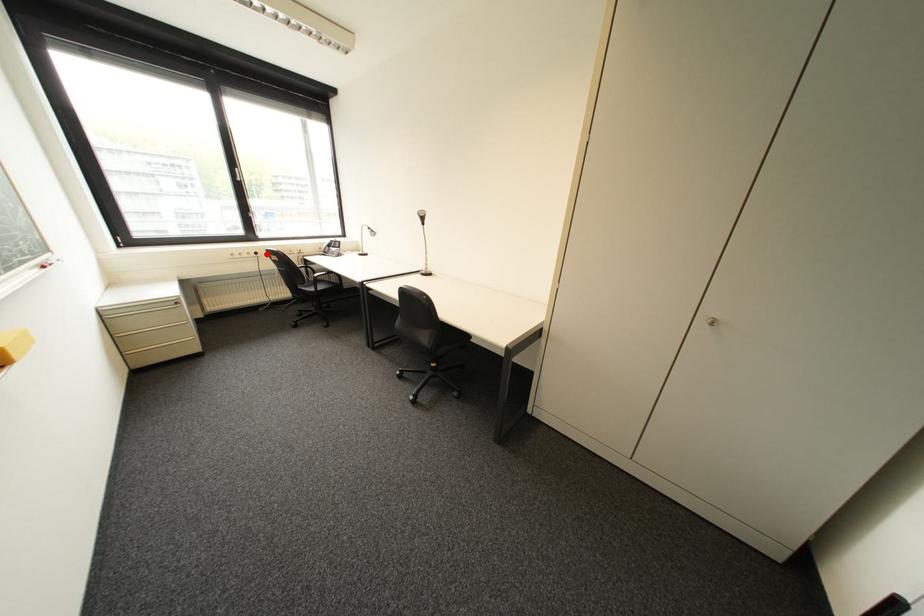
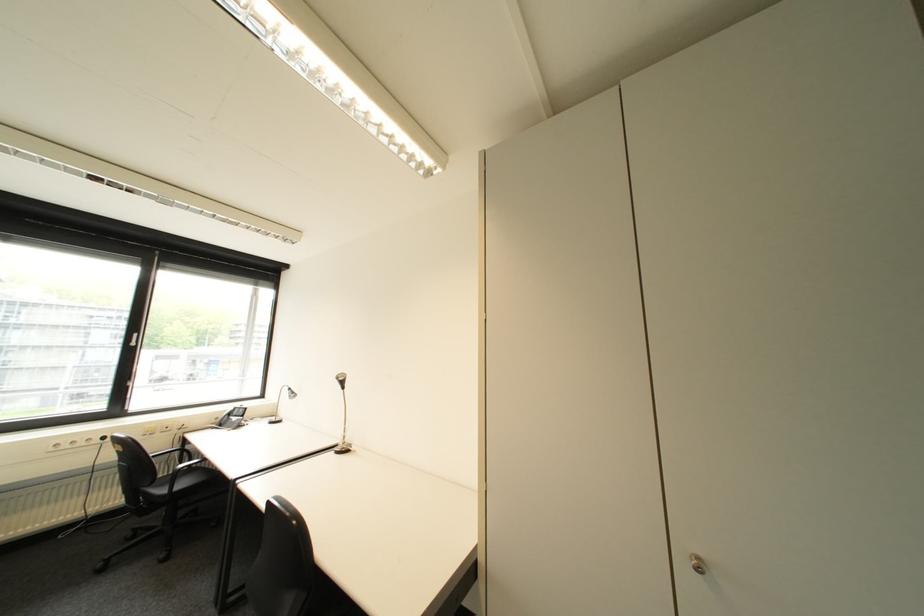
The point at the highlighted location is marked in the first image. Where is the corresponding point in the second image?

(114, 439)